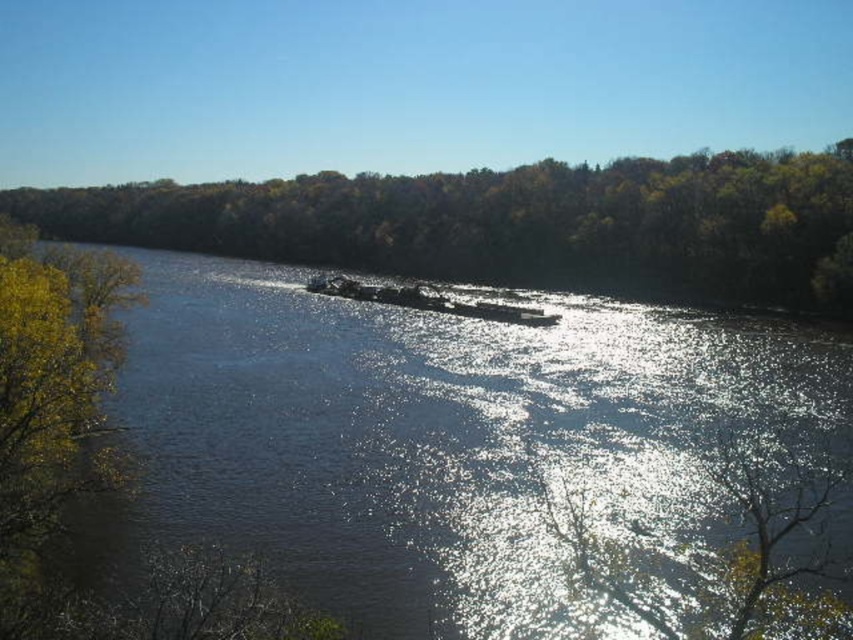
Question: From the image, what is the correct spatial relationship of green leafy trees at center in relation to metallic gray barge at center?

Choices:
 (A) below
 (B) above

Answer: (B)

Question: Which object is the closest to the metallic gray barge at center?

Choices:
 (A) green leafy trees at center
 (B) dark blue water at center

Answer: (B)

Question: Which point is closer to the camera taking this photo?

Choices:
 (A) (573, 541)
 (B) (496, 314)

Answer: (A)

Question: Does dark blue water at center come behind metallic gray barge at center?

Choices:
 (A) no
 (B) yes

Answer: (A)

Question: Which object is positioned farthest from the dark blue water at center?

Choices:
 (A) green leafy trees at center
 (B) metallic gray barge at center

Answer: (A)

Question: In this image, where is dark blue water at center located relative to green leafy trees at center?

Choices:
 (A) left
 (B) right

Answer: (B)